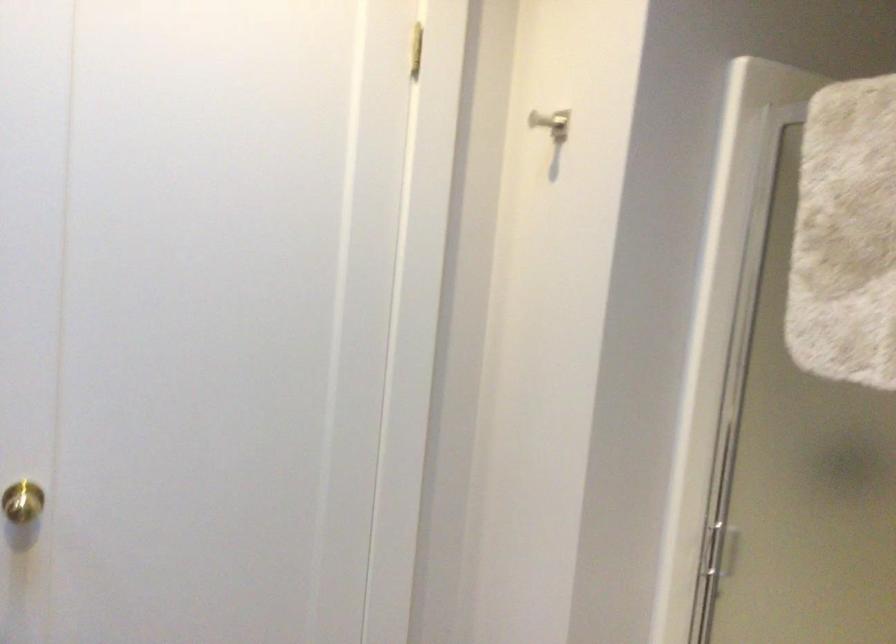
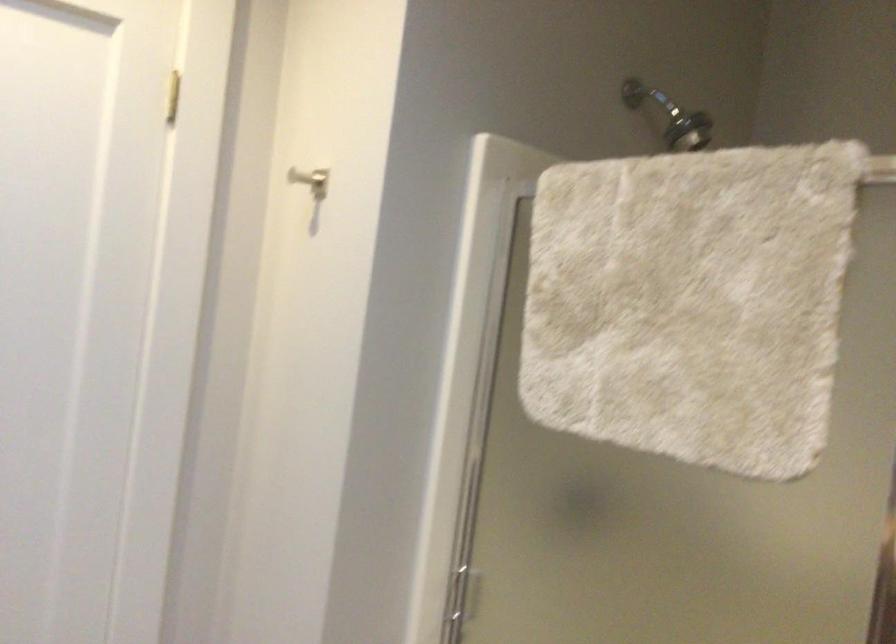
Question: The camera is either moving clockwise (left) or counter-clockwise (right) around the object. The first image is from the beginning of the video and the second image is from the end. Is the camera moving left or right when shooting the video?

Choices:
 (A) Left
 (B) Right

Answer: (A)